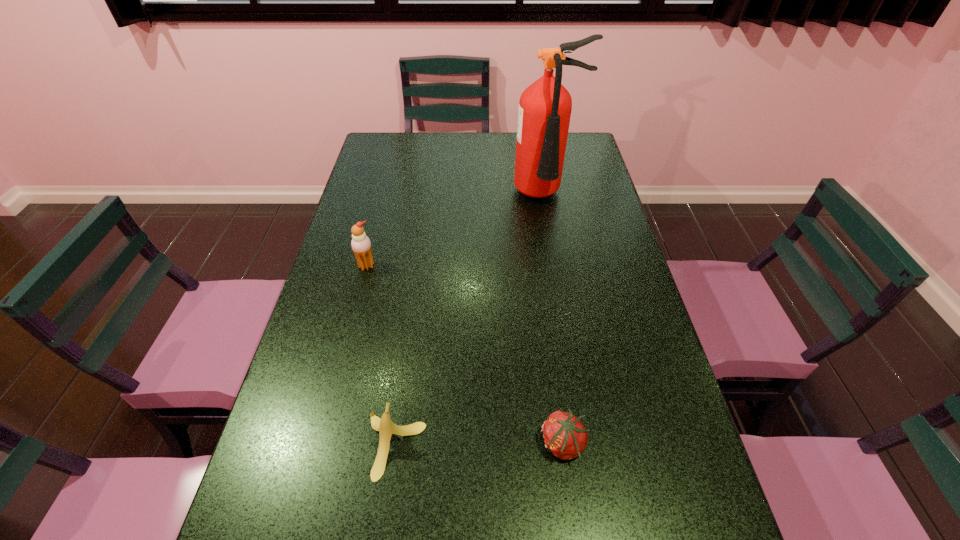
The height and width of the screenshot is (540, 960). What are the coordinates of `the farthest object` in the screenshot? It's located at (545, 107).

Where is `the tallest object`? The height and width of the screenshot is (540, 960). the tallest object is located at coordinates (545, 107).

Identify the location of icecream. Image resolution: width=960 pixels, height=540 pixels. (361, 245).

You are a GUI agent. You are given a task and a screenshot of the screen. Output one action in this format:
    pyautogui.click(x=<x>, y=<y>)
    Task: Click on the second farthest object
    
    Given the screenshot: What is the action you would take?
    pyautogui.click(x=361, y=245)

I want to click on banana, so click(x=385, y=426).

This screenshot has width=960, height=540. Identify the location of the third tallest object. pyautogui.click(x=385, y=426).

At what (x,y) coordinates should I click in order to perform the action: click on the shortest object. Please return your answer as a coordinate pair (x, y). Looking at the image, I should click on (564, 435).

I want to click on vacant space situated at the nozzle of the farthest object, so click(x=553, y=237).

Locate an element on the screen. The height and width of the screenshot is (540, 960). vacant point located at the front with a straw on the icecream is located at coordinates (348, 340).

Identify the location of blank area located 0.100m on the front of the second shortest object. This screenshot has height=540, width=960. [381, 539].